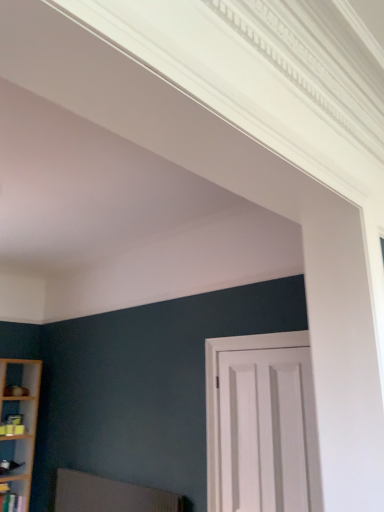
Question: Is white matte door at center taller or shorter than textured fabric swivel chair at lower left?

Choices:
 (A) tall
 (B) short

Answer: (A)

Question: Considering the positions of point (211, 414) and point (132, 505), is point (211, 414) closer or farther from the camera than point (132, 505)?

Choices:
 (A) farther
 (B) closer

Answer: (B)

Question: Estimate the real-world distances between objects in this image. Which object is closer to the textured fabric swivel chair at lower left?

Choices:
 (A) white matte door at center
 (B) wooden shelf at lower left

Answer: (A)

Question: Which of these objects is positioned farthest from the wooden shelf at lower left?

Choices:
 (A) textured fabric swivel chair at lower left
 (B) white matte door at center

Answer: (B)